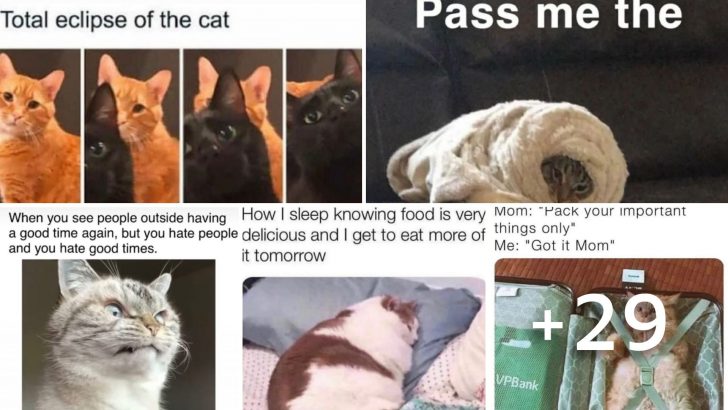
The height and width of the screenshot is (410, 728). In order to click on pillow in this screenshot , I will do tap(296, 306).